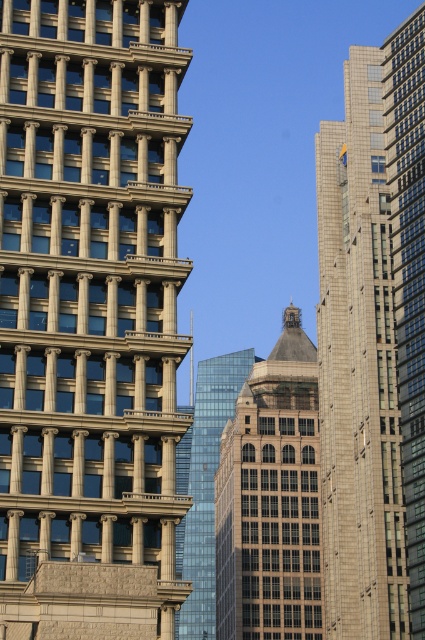
From the picture: You are an architect reviewing a city layout. You see the beige stone tower at left and the glassy blue skyscraper at center. Which building appears closer to the front of the image?

The beige stone tower at left appears closer to the front of the image because it is positioned over the glassy blue skyscraper at center, indicating it is in front.

You are a drone operator trying to capture aerial footage of the city. You need to film both the dark gray glass tower at center and the glassy blue skyscraper at center. Which building should you position the drone in front of to ensure both are visible in the shot?

You should position the drone in front of the dark gray glass tower at center because the glassy blue skyscraper at center is behind it, allowing both to be visible in the shot.